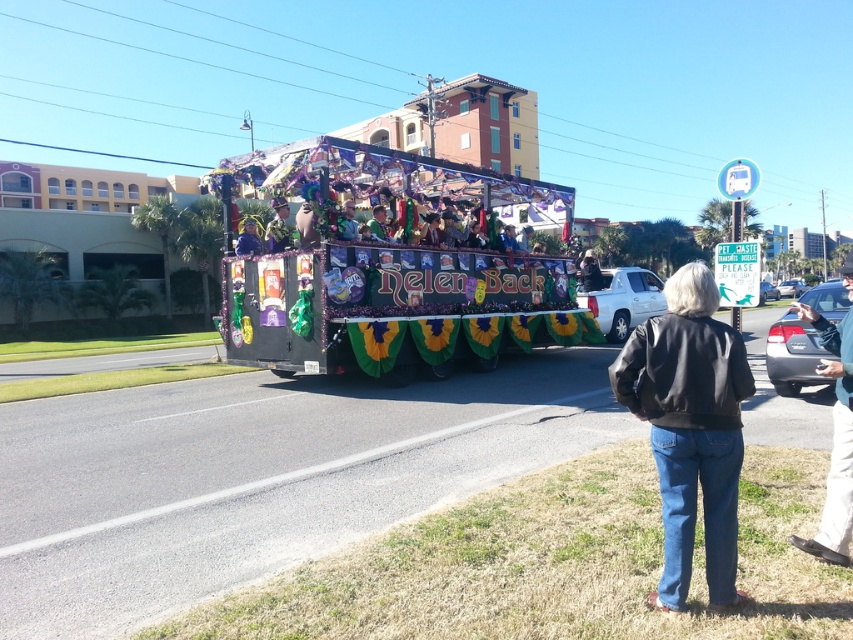
Question: Which is farther from the black leather jacket at lower right?

Choices:
 (A) blue fabric at center
 (B) khaki pants at lower right

Answer: (A)

Question: Based on their relative distances, which object is nearer to the blue fabric at center?

Choices:
 (A) khaki pants at lower right
 (B) black leather jacket at lower right

Answer: (B)

Question: Can you confirm if khaki pants at lower right is wider than blue fabric at center?

Choices:
 (A) no
 (B) yes

Answer: (B)

Question: Is the position of black leather jacket at lower right less distant than that of khaki pants at lower right?

Choices:
 (A) no
 (B) yes

Answer: (B)

Question: Does khaki pants at lower right have a larger size compared to blue fabric at center?

Choices:
 (A) yes
 (B) no

Answer: (A)

Question: Among these objects, which one is farthest from the camera?

Choices:
 (A) khaki pants at lower right
 (B) black leather jacket at lower right
 (C) blue fabric at center

Answer: (C)